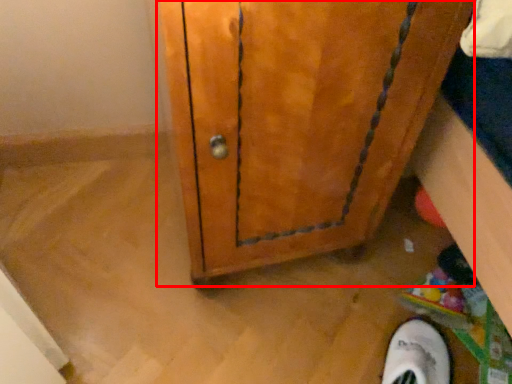
Question: From the image's perspective, what is the correct spatial positioning of door (annotated by the red box) in reference to footwear?

Choices:
 (A) above
 (B) below

Answer: (A)